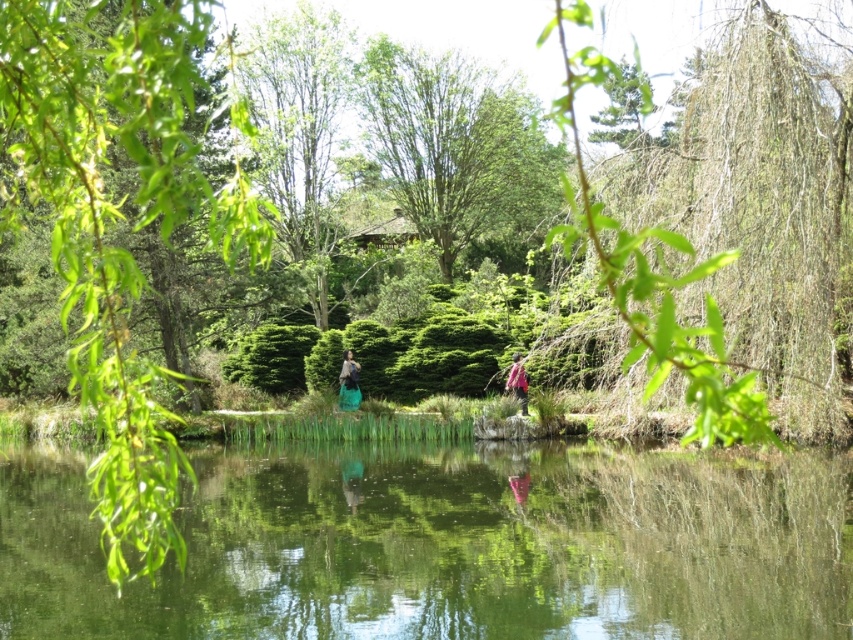
Question: Among these points, which one is nearest to the camera?

Choices:
 (A) (376, 148)
 (B) (822, 518)

Answer: (B)

Question: Does green leafy tree at upper right appear on the right side of green fabric bag at center?

Choices:
 (A) no
 (B) yes

Answer: (B)

Question: Is green leafy tree at center to the left of pink fabric backpack at center-right from the viewer's perspective?

Choices:
 (A) no
 (B) yes

Answer: (B)

Question: Among these points, which one is nearest to the camera?

Choices:
 (A) (309, 541)
 (B) (106, 378)
 (C) (442, 259)
 (D) (345, 397)

Answer: (B)

Question: Which of the following is the farthest from the observer?

Choices:
 (A) (572, 76)
 (B) (67, 500)
 (C) (86, 115)

Answer: (B)

Question: Is green leafy tree at upper right to the right of pink fabric backpack at center-right from the viewer's perspective?

Choices:
 (A) yes
 (B) no

Answer: (A)